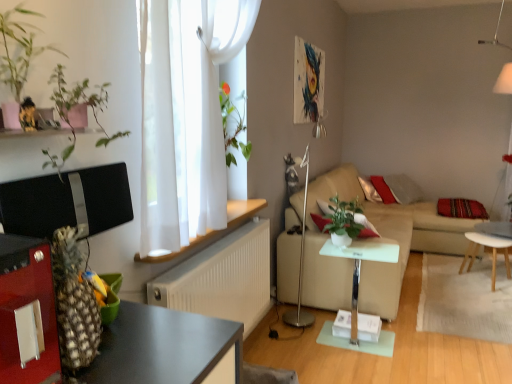
Question: Relative to white textured radiator at center, is green matte plant at upper left in front or behind?

Choices:
 (A) behind
 (B) front

Answer: (B)

Question: Would you say green matte plant at upper left is inside or outside white textured radiator at center?

Choices:
 (A) outside
 (B) inside

Answer: (A)

Question: Based on their relative distances, which object is nearer to the white sheer curtain at upper center?

Choices:
 (A) beige fabric couch at center-right
 (B) silver metallic floor lamp at center, positioned as the 1th lamp in left-to-right order
 (C) green matte plant at upper left, the 2th plant from the bottom
 (D) wooden pineapple at left
 (E) white textured radiator at center

Answer: (C)

Question: Which of these objects is positioned closest to the white sheer curtain at upper center?

Choices:
 (A) white glossy side table at center, which is the 2th table in back-to-front order
 (B) beige fabric couch at center-right
 (C) wooden pineapple at left
 (D) green matte plant at upper left
 (E) green matte plant at center, marked as the first plant in a right-to-left arrangement

Answer: (D)